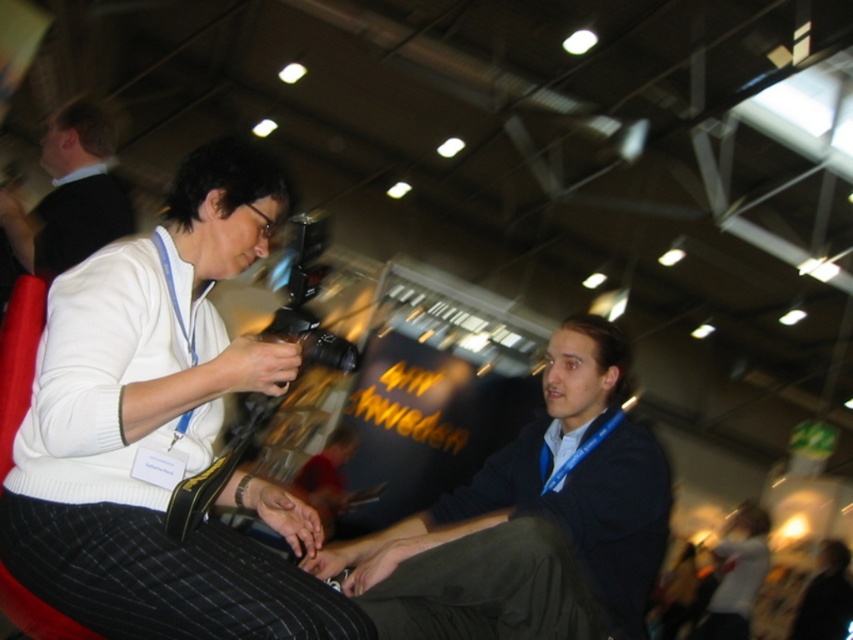
You are standing in the convention center and see a point marked at coordinates (155, 428). Which object is this point located on?

The point is located on the white matte sweater at upper left.

You are a photographer at the convention center. You need to focus your camera on the object that is closer to you between the white matte sweater at upper left and the matte white shirt at lower right. Which one should you choose?

The white matte sweater at upper left is closer to the viewer than the matte white shirt at lower right, so you should focus your camera on the white matte sweater at upper left.